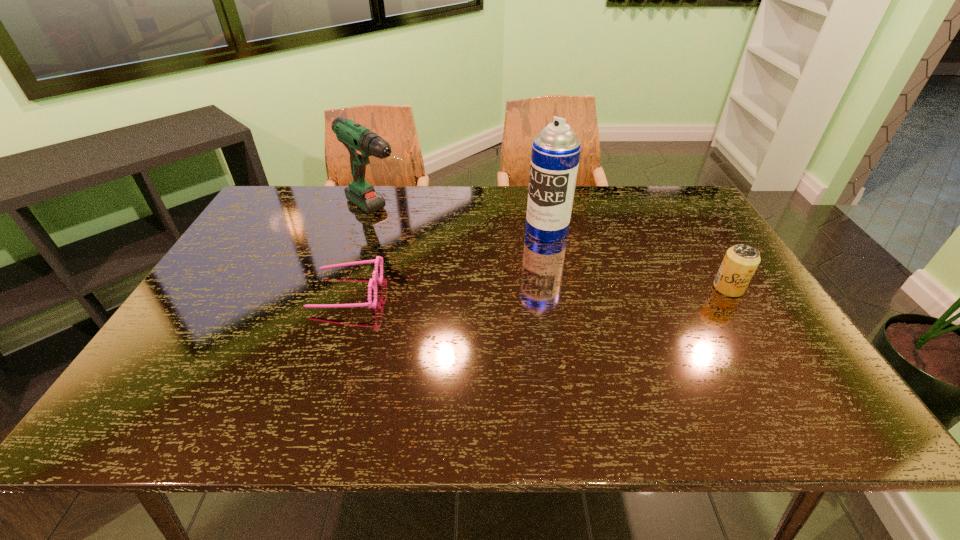
I want to click on free space on the desktop that is between the spectacles and the beer can and is positioned on the handle side of the third shortest object, so click(490, 291).

Identify the location of free space on the desktop that is between the spectacles and the beer can and is positioned on the label side of the third object from left to right. This screenshot has width=960, height=540. (482, 291).